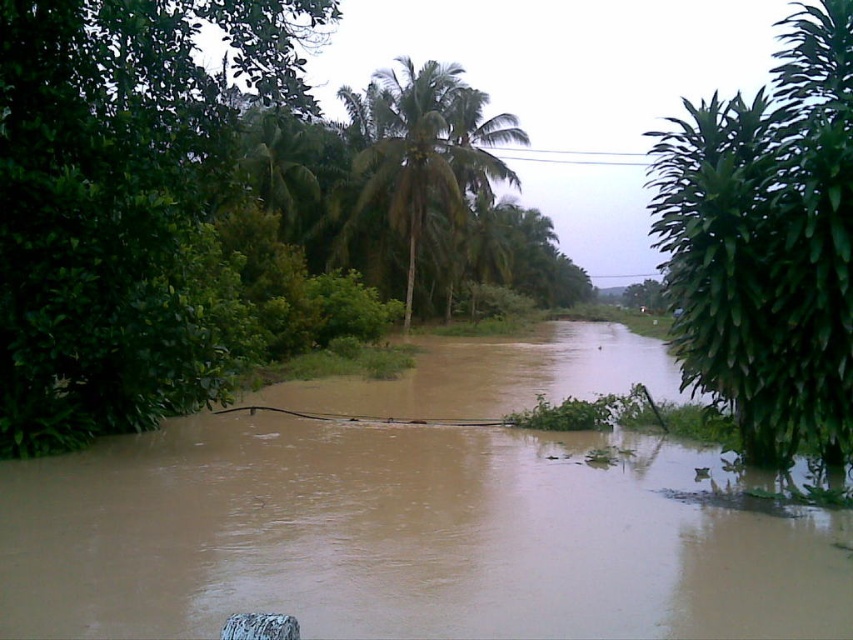
Is green leafy tree at left taller than green leafy palm tree at center?

Indeed, green leafy tree at left has a greater height compared to green leafy palm tree at center.

Who is more distant from viewer, [112,422] or [390,80]?

The point [390,80] is behind.

Is point (122, 333) behind point (352, 109)?

No, (122, 333) is closer to viewer.

The image size is (853, 640). Find the location of `green leafy tree at left`. green leafy tree at left is located at coordinates (117, 200).

Which is below, green leafy tree at left or green leafy tree at right?

green leafy tree at left is lower down.

What do you see at coordinates (117, 200) in the screenshot? The width and height of the screenshot is (853, 640). I see `green leafy tree at left` at bounding box center [117, 200].

Which is in front, point (155, 32) or point (811, 412)?

Positioned in front is point (811, 412).

You are a GUI agent. You are given a task and a screenshot of the screen. Output one action in this format:
    pyautogui.click(x=<x>, y=<y>)
    Task: Click on the green leafy tree at left
    This screenshot has height=640, width=853.
    Given the screenshot: What is the action you would take?
    pyautogui.click(x=117, y=200)

Does point (834, 358) lie behind point (358, 168)?

No, it is in front of (358, 168).

Based on the photo, measure the distance between green leafy tree at right and green leafy palm tree at center.

green leafy tree at right is 90.88 feet away from green leafy palm tree at center.

Is point (833, 340) farther from camera compared to point (498, 160)?

That is False.

In order to click on green leafy tree at right in this screenshot , I will do `click(767, 244)`.